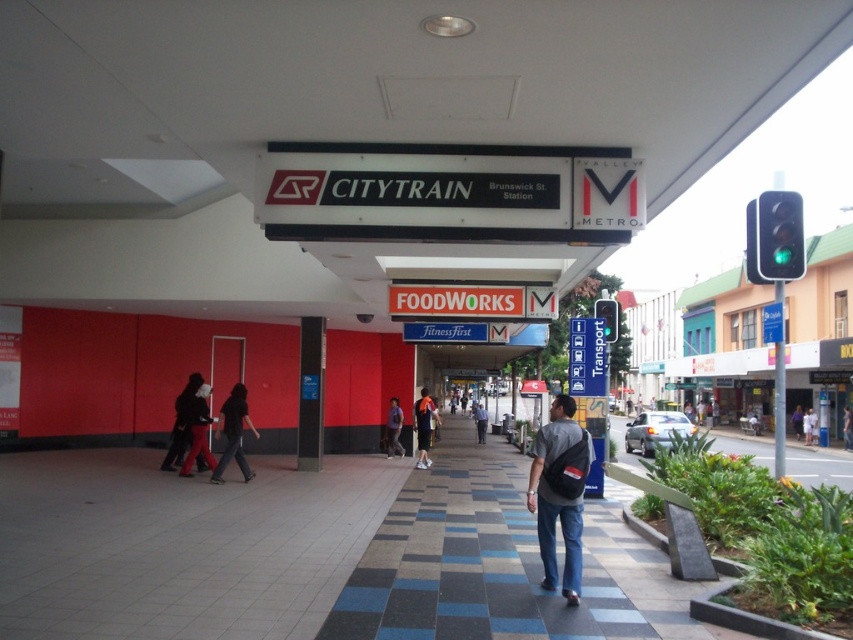
Question: Can you confirm if dark blue shirt at center is positioned above denim jacket at center?

Choices:
 (A) yes
 (B) no

Answer: (A)

Question: Which point is farther to the camera?

Choices:
 (A) (218, 481)
 (B) (846, 442)

Answer: (B)

Question: Is dark blue shirt at center positioned behind dark gray backpack at center?

Choices:
 (A) yes
 (B) no

Answer: (B)

Question: Which point is farther from the camera taking this photo?

Choices:
 (A) (482, 412)
 (B) (769, 244)

Answer: (A)

Question: Is matte black jacket at center positioned at the back of green glass traffic light at center?

Choices:
 (A) no
 (B) yes

Answer: (A)

Question: Which point is closer to the camera?

Choices:
 (A) white cotton shirt at center
 (B) matte black backpack at center

Answer: (B)